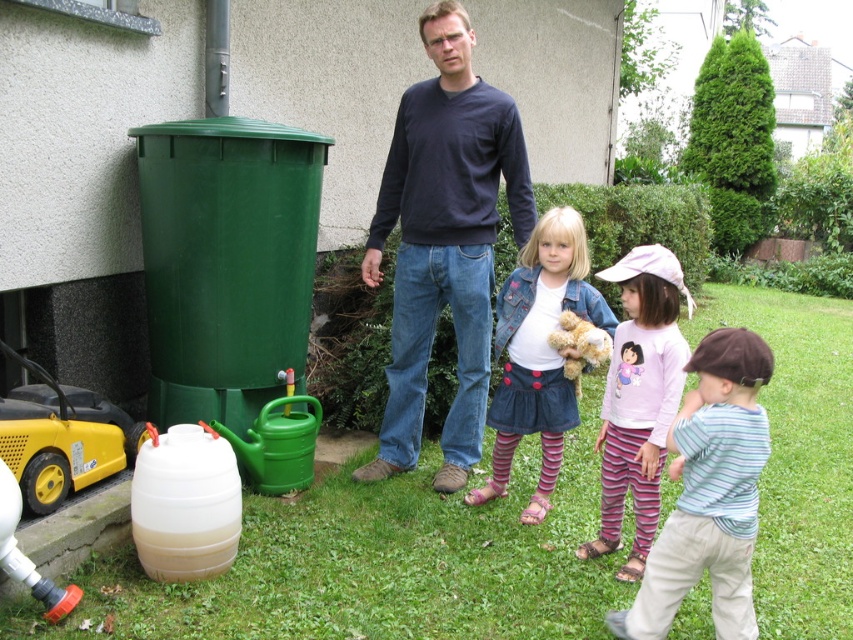
Image resolution: width=853 pixels, height=640 pixels. What do you see at coordinates (444, 241) in the screenshot? I see `dark blue sweater at center` at bounding box center [444, 241].

Is dark blue sweater at center to the right of pink cotton shirt at center from the viewer's perspective?

Incorrect, dark blue sweater at center is not on the right side of pink cotton shirt at center.

Image resolution: width=853 pixels, height=640 pixels. I want to click on dark blue sweater at center, so click(444, 241).

Which is in front, point (844, 371) or point (392, 324)?

Positioned in front is point (392, 324).

Between green grass at center and dark blue sweater at center, which one has less height?

Standing shorter between the two is green grass at center.

Is point (511, 600) in front of point (383, 435)?

Yes.

Where is `green grass at center`? Image resolution: width=853 pixels, height=640 pixels. green grass at center is located at coordinates (379, 564).

Is dark blue sweater at center positioned behind striped cotton pants at center?

Yes, dark blue sweater at center is further from the viewer.

Who is more forward, (432, 12) or (682, 392)?

Point (682, 392) is more forward.

You are a GUI agent. You are given a task and a screenshot of the screen. Output one action in this format:
    pyautogui.click(x=<x>, y=<y>)
    Task: Click on the dark blue sweater at center
    The image size is (853, 640).
    Given the screenshot: What is the action you would take?
    pyautogui.click(x=444, y=241)